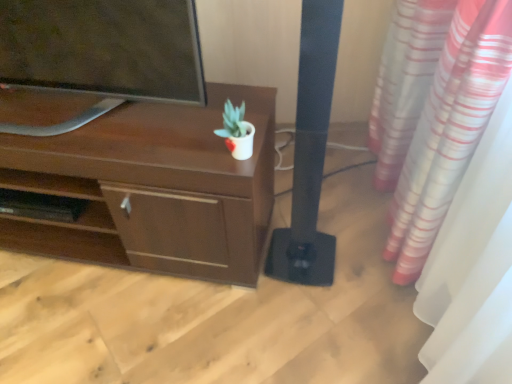
Question: Does white glossy pot at center have a greater width compared to brown matte desk at upper left?

Choices:
 (A) yes
 (B) no

Answer: (B)

Question: Is white glossy pot at center not close to brown matte desk at upper left?

Choices:
 (A) yes
 (B) no

Answer: (B)

Question: Is white glossy pot at center to the right of brown matte desk at upper left from the viewer's perspective?

Choices:
 (A) no
 (B) yes

Answer: (B)

Question: From a real-world perspective, is white glossy pot at center positioned over brown matte desk at upper left based on gravity?

Choices:
 (A) yes
 (B) no

Answer: (A)

Question: From a real-world perspective, is white glossy pot at center positioned under brown matte desk at upper left based on gravity?

Choices:
 (A) yes
 (B) no

Answer: (B)

Question: Can you confirm if white glossy pot at center is bigger than brown matte desk at upper left?

Choices:
 (A) yes
 (B) no

Answer: (B)

Question: Does brown matte desk at upper left have a lesser height compared to black matte speaker at center?

Choices:
 (A) yes
 (B) no

Answer: (A)

Question: Is brown matte desk at upper left facing towards black matte speaker at center?

Choices:
 (A) no
 (B) yes

Answer: (A)

Question: Is brown matte desk at upper left closer to camera compared to black matte speaker at center?

Choices:
 (A) yes
 (B) no

Answer: (B)

Question: From the image's perspective, is brown matte desk at upper left beneath black matte speaker at center?

Choices:
 (A) no
 (B) yes

Answer: (B)

Question: Does brown matte desk at upper left have a smaller size compared to black matte speaker at center?

Choices:
 (A) yes
 (B) no

Answer: (B)

Question: From the image's perspective, is brown matte desk at upper left above black matte speaker at center?

Choices:
 (A) no
 (B) yes

Answer: (A)

Question: Is black matte speaker at center not within brown matte desk at upper left?

Choices:
 (A) yes
 (B) no

Answer: (A)